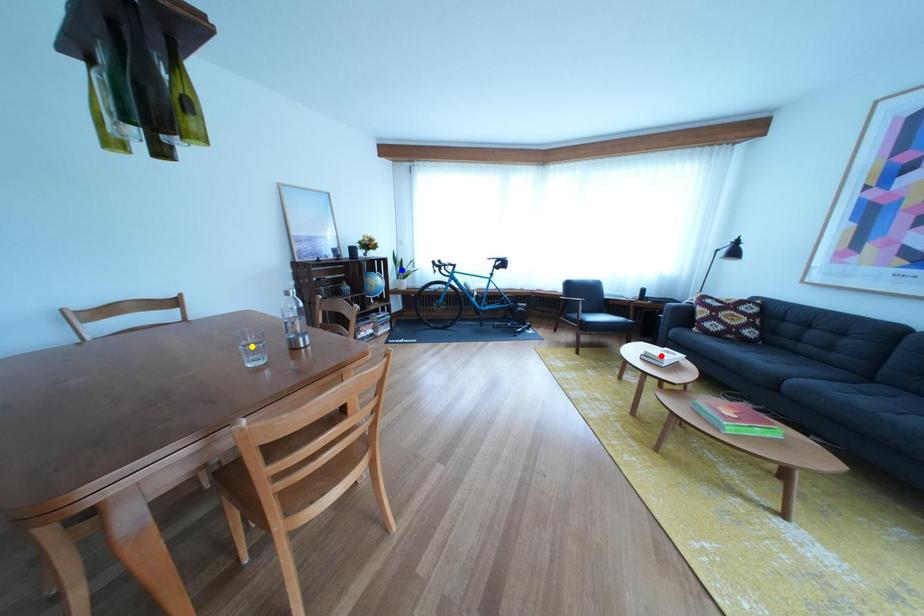
Order these from farthest to nearest:
yellow point, red point, blue point

blue point
red point
yellow point